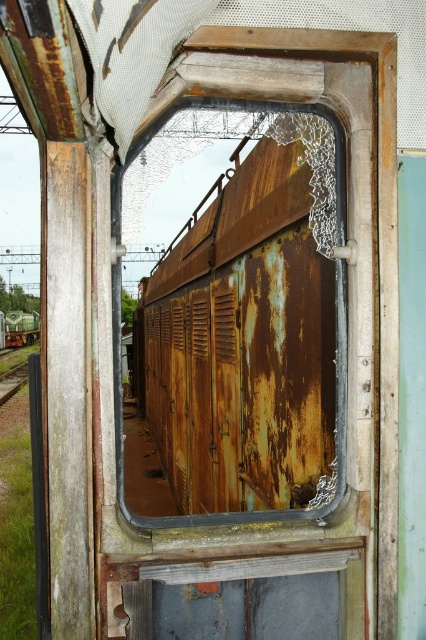
Between point (36, 337) and point (23, 384), which one is positioned in front?

Point (23, 384) is in front.

Image resolution: width=426 pixels, height=640 pixels. I want to click on rusty metal train at left, so click(20, 328).

Looking at this image, is rusty metal train at center to the right of brown wooden train track at left from the viewer's perspective?

Indeed, rusty metal train at center is positioned on the right side of brown wooden train track at left.

Is point (184, 440) positioned in front of point (19, 371)?

Yes, it is.

The image size is (426, 640). Find the location of `rusty metal train at center`. rusty metal train at center is located at coordinates (250, 317).

Who is more forward, (x=166, y=227) or (x=34, y=337)?

Positioned in front is point (x=166, y=227).

Can you confirm if rusty metal train at center is wider than rusty metal train at left?

Indeed, rusty metal train at center has a greater width compared to rusty metal train at left.

Does point (173, 493) lie behind point (17, 316)?

No, it is in front of (17, 316).

This screenshot has height=640, width=426. I want to click on rusty metal train at center, so click(250, 317).